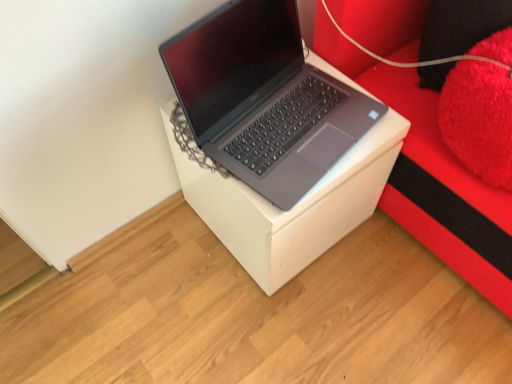
Where is `fluffy red pillow at upper right, the second pillow when ordered from top to bottom`? The height and width of the screenshot is (384, 512). fluffy red pillow at upper right, the second pillow when ordered from top to bottom is located at coordinates [x=481, y=110].

Image resolution: width=512 pixels, height=384 pixels. What do you see at coordinates (481, 110) in the screenshot? I see `fluffy red pillow at upper right, which is the 1th pillow in bottom-to-top order` at bounding box center [481, 110].

This screenshot has height=384, width=512. Find the location of `black fuzzy pillow at upper right, which appears as the 2th pillow when ordered from the bottom`. black fuzzy pillow at upper right, which appears as the 2th pillow when ordered from the bottom is located at coordinates (461, 26).

Between white cardboard box at center and black fuzzy pillow at upper right, which appears as the 2th pillow when ordered from the bottom, which one appears on the right side from the viewer's perspective?

black fuzzy pillow at upper right, which appears as the 2th pillow when ordered from the bottom, is more to the right.

Which is less distant, (379, 148) or (453, 49)?

Clearly, point (379, 148) is closer to the camera than point (453, 49).

Is there a large distance between white cardboard box at center and black fuzzy pillow at upper right, which is counted as the first pillow, starting from the top?

No, white cardboard box at center is not far from black fuzzy pillow at upper right, which is counted as the first pillow, starting from the top.

Between white cardboard box at center and black fuzzy pillow at upper right, which is counted as the first pillow, starting from the top, which one has less height?

With less height is black fuzzy pillow at upper right, which is counted as the first pillow, starting from the top.

Can white cardboard box at center be found inside fluffy red pillow at upper right, which is the 1th pillow in bottom-to-top order?

No, fluffy red pillow at upper right, which is the 1th pillow in bottom-to-top order, does not contain white cardboard box at center.

From the picture: Is fluffy red pillow at upper right, the second pillow when ordered from top to bottom, taller or shorter than white cardboard box at center?

In the image, fluffy red pillow at upper right, the second pillow when ordered from top to bottom, appears to be shorter than white cardboard box at center.

Considering the sizes of fluffy red pillow at upper right, which is the 1th pillow in bottom-to-top order, and white cardboard box at center in the image, is fluffy red pillow at upper right, which is the 1th pillow in bottom-to-top order, wider or thinner than white cardboard box at center?

fluffy red pillow at upper right, which is the 1th pillow in bottom-to-top order, is thinner than white cardboard box at center.

How different are the orientations of fluffy red pillow at upper right, the second pillow when ordered from top to bottom, and white cardboard box at center in degrees?

Answer: 0.00168 degrees.

Between fluffy red pillow at upper right, the second pillow when ordered from top to bottom, and red plush cushion at right, which one appears on the right side from the viewer's perspective?

Positioned to the right is red plush cushion at right.

This screenshot has height=384, width=512. In the image, there is a red plush cushion at right. Identify the location of pillow below it (from the image's perspective). (481, 110).

Can you tell me how much fluffy red pillow at upper right, the second pillow when ordered from top to bottom, and red plush cushion at right differ in facing direction?

fluffy red pillow at upper right, the second pillow when ordered from top to bottom, and red plush cushion at right are facing 0.00123 degrees away from each other.

Can you confirm if fluffy red pillow at upper right, the second pillow when ordered from top to bottom, is shorter than red plush cushion at right?

Correct, fluffy red pillow at upper right, the second pillow when ordered from top to bottom, is not as tall as red plush cushion at right.

Does fluffy red pillow at upper right, the second pillow when ordered from top to bottom, touch black fuzzy pillow at upper right, which is counted as the first pillow, starting from the top?

No, fluffy red pillow at upper right, the second pillow when ordered from top to bottom, is not in contact with black fuzzy pillow at upper right, which is counted as the first pillow, starting from the top.

Would you say fluffy red pillow at upper right, which is the 1th pillow in bottom-to-top order, is to the left or to the right of black fuzzy pillow at upper right, which is counted as the first pillow, starting from the top, in the picture?

fluffy red pillow at upper right, which is the 1th pillow in bottom-to-top order, is to the left of black fuzzy pillow at upper right, which is counted as the first pillow, starting from the top.

From a real-world perspective, is fluffy red pillow at upper right, the second pillow when ordered from top to bottom, on black fuzzy pillow at upper right, which appears as the 2th pillow when ordered from the bottom?

Indeed, from a real-world perspective, fluffy red pillow at upper right, the second pillow when ordered from top to bottom, stands above black fuzzy pillow at upper right, which appears as the 2th pillow when ordered from the bottom.

Between red plush cushion at right and fluffy red pillow at upper right, the second pillow when ordered from top to bottom, which one is positioned in front?

Positioned in front is red plush cushion at right.

In the scene shown: In the image, is red plush cushion at right on the left side or the right side of fluffy red pillow at upper right, which is the 1th pillow in bottom-to-top order?

In the image, red plush cushion at right appears on the right side of fluffy red pillow at upper right, which is the 1th pillow in bottom-to-top order.

Which is in front, point (455, 164) or point (468, 145)?

The point (468, 145) is closer.

Is red plush cushion at right beside fluffy red pillow at upper right, the second pillow when ordered from top to bottom?

No, red plush cushion at right is not touching fluffy red pillow at upper right, the second pillow when ordered from top to bottom.

Is white cardboard box at center completely or partially inside red plush cushion at right?

No, red plush cushion at right does not contain white cardboard box at center.

Looking at this image, does red plush cushion at right have a lesser height compared to white cardboard box at center?

In fact, red plush cushion at right may be taller than white cardboard box at center.

Is red plush cushion at right bigger or smaller than white cardboard box at center?

Considering their sizes, red plush cushion at right takes up more space than white cardboard box at center.

From a real-world perspective, is white cardboard box at center beneath sleek silver laptop at center?

Yes, from a real-world perspective, white cardboard box at center is beneath sleek silver laptop at center.

How distant is white cardboard box at center from sleek silver laptop at center?

5.85 inches.

Consider the image. From the image's perspective, does white cardboard box at center appear lower than sleek silver laptop at center?

Correct, white cardboard box at center appears lower than sleek silver laptop at center in the image.

Find the location of `table behind the sleek silver laptop at center`. table behind the sleek silver laptop at center is located at coordinates (292, 207).

Where is `table below the black fuzzy pillow at upper right, which appears as the 2th pillow when ordered from the bottom (from the image's perspective)`? This screenshot has height=384, width=512. table below the black fuzzy pillow at upper right, which appears as the 2th pillow when ordered from the bottom (from the image's perspective) is located at coordinates (292, 207).

Image resolution: width=512 pixels, height=384 pixels. In order to click on table behind the fluffy red pillow at upper right, the second pillow when ordered from top to bottom in this screenshot , I will do `click(292, 207)`.

Which object lies nearer to the anchor point fluffy red pillow at upper right, which is the 1th pillow in bottom-to-top order, red plush cushion at right or sleek silver laptop at center?

red plush cushion at right is closer to fluffy red pillow at upper right, which is the 1th pillow in bottom-to-top order.

Which object lies further to the anchor point fluffy red pillow at upper right, which is the 1th pillow in bottom-to-top order, white cardboard box at center or red plush cushion at right?

white cardboard box at center.

Estimate the real-world distances between objects in this image. Which object is further from black fuzzy pillow at upper right, which appears as the 2th pillow when ordered from the bottom, red plush cushion at right or white cardboard box at center?

white cardboard box at center.

Which object lies further to the anchor point sleek silver laptop at center, fluffy red pillow at upper right, which is the 1th pillow in bottom-to-top order, or black fuzzy pillow at upper right, which is counted as the first pillow, starting from the top?

The object further to sleek silver laptop at center is black fuzzy pillow at upper right, which is counted as the first pillow, starting from the top.

When comparing their distances from sleek silver laptop at center, does black fuzzy pillow at upper right, which appears as the 2th pillow when ordered from the bottom, or red plush cushion at right seem further?

black fuzzy pillow at upper right, which appears as the 2th pillow when ordered from the bottom, lies further to sleek silver laptop at center than the other object.

Which object lies further to the anchor point fluffy red pillow at upper right, which is the 1th pillow in bottom-to-top order, black fuzzy pillow at upper right, which is counted as the first pillow, starting from the top, or white cardboard box at center?

The object further to fluffy red pillow at upper right, which is the 1th pillow in bottom-to-top order, is white cardboard box at center.

Which object lies nearer to the anchor point white cardboard box at center, black fuzzy pillow at upper right, which is counted as the first pillow, starting from the top, or fluffy red pillow at upper right, the second pillow when ordered from top to bottom?

fluffy red pillow at upper right, the second pillow when ordered from top to bottom, is closer to white cardboard box at center.

Which object lies nearer to the anchor point white cardboard box at center, sleek silver laptop at center or red plush cushion at right?

sleek silver laptop at center is positioned closer to the anchor white cardboard box at center.

This screenshot has height=384, width=512. What are the coordinates of `pillow between white cardboard box at center and black fuzzy pillow at upper right, which is counted as the first pillow, starting from the top, in the horizontal direction` in the screenshot? It's located at (481, 110).

Where is `laptop situated between white cardboard box at center and black fuzzy pillow at upper right, which appears as the 2th pillow when ordered from the bottom, from left to right`? laptop situated between white cardboard box at center and black fuzzy pillow at upper right, which appears as the 2th pillow when ordered from the bottom, from left to right is located at coordinates point(264,98).

At what (x,y) coordinates should I click in order to perform the action: click on pillow between sleek silver laptop at center and black fuzzy pillow at upper right, which appears as the 2th pillow when ordered from the bottom, from left to right. Please return your answer as a coordinate pair (x, y). The image size is (512, 384). Looking at the image, I should click on (481, 110).

Locate an element on the screen. This screenshot has height=384, width=512. laptop situated between white cardboard box at center and red plush cushion at right from left to right is located at coordinates (264, 98).